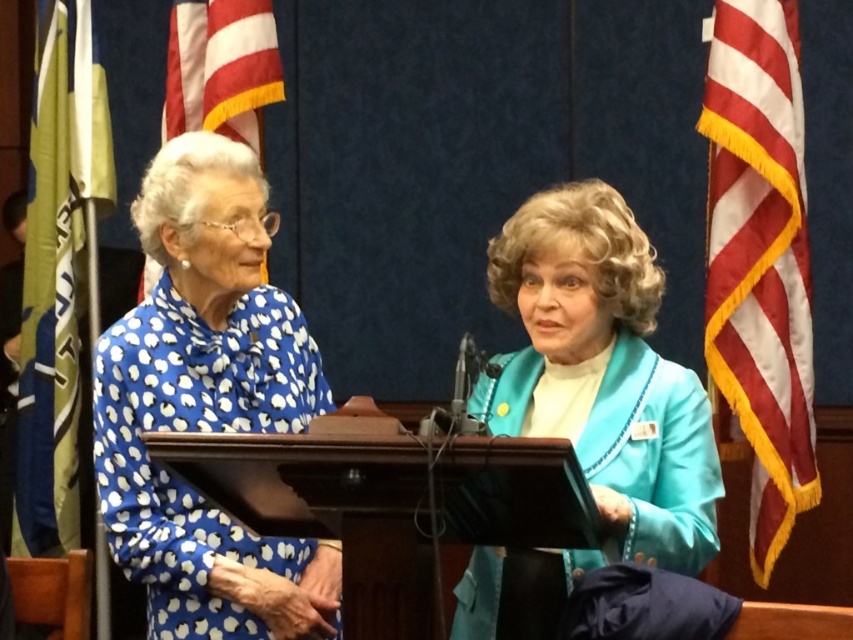
You are a photographer at a formal event. You need to capture a photo where the blue dotted blouse at left is clearly visible without being blocked by the striped fabric flag at right. Based on the scene, can you position yourself in a way to achieve this?

Yes, because the blue dotted blouse at left is in front of the striped fabric flag at right, positioning yourself so that the blouse is between the flag and the camera will ensure the blouse is visible and not blocked.

You are attending a formal event and notice the blue dotted blouse at left and the striped fabric flag at right. Based on their positions, which object is closer to the ground?

The blue dotted blouse at left is located below the striped fabric flag at right, so it is closer to the ground.

You are standing at a distance of 10 feet from the podium in the image. You want to hand a document to the person wearing the teal satin blazer at center. Can you reach them without moving closer than your current position?

The teal satin blazer at center is 7.71 feet away from the viewer. Since you are currently 10 feet away from the podium, you cannot reach them without moving closer as the distance is greater than the required reach.